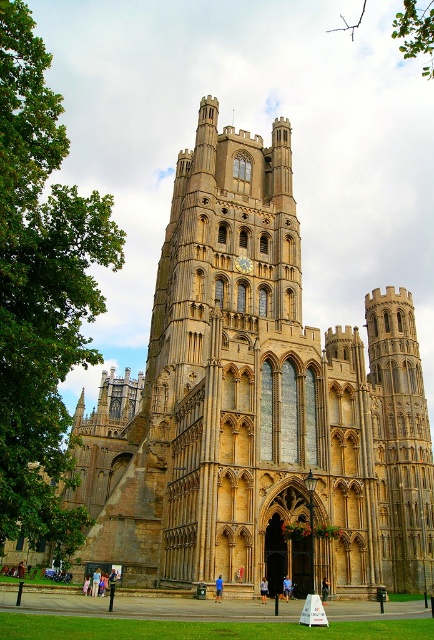
Question: Which object appears closest to the camera in this image?

Choices:
 (A) green leafy tree at left
 (B) golden stone church at center

Answer: (A)

Question: Which point is closer to the camera taking this photo?

Choices:
 (A) (345, 472)
 (B) (23, 500)

Answer: (B)

Question: Does green leafy tree at left appear under gold metallic clock at center?

Choices:
 (A) yes
 (B) no

Answer: (A)

Question: Is green leafy branch at upper center positioned before gold metallic clock at center?

Choices:
 (A) no
 (B) yes

Answer: (B)

Question: Is green leafy tree at left thinner than green leafy branch at upper center?

Choices:
 (A) yes
 (B) no

Answer: (A)

Question: Which point is closer to the camera taking this photo?

Choices:
 (A) (229, 524)
 (B) (410, 6)

Answer: (A)